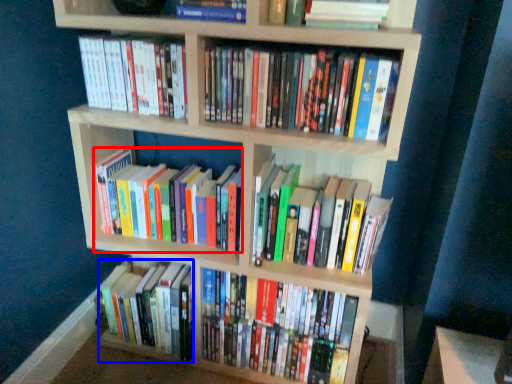
Question: Which of the following is the farthest to the observer, book (highlighted by a red box) or book (highlighted by a blue box)?

Choices:
 (A) book
 (B) book

Answer: (B)